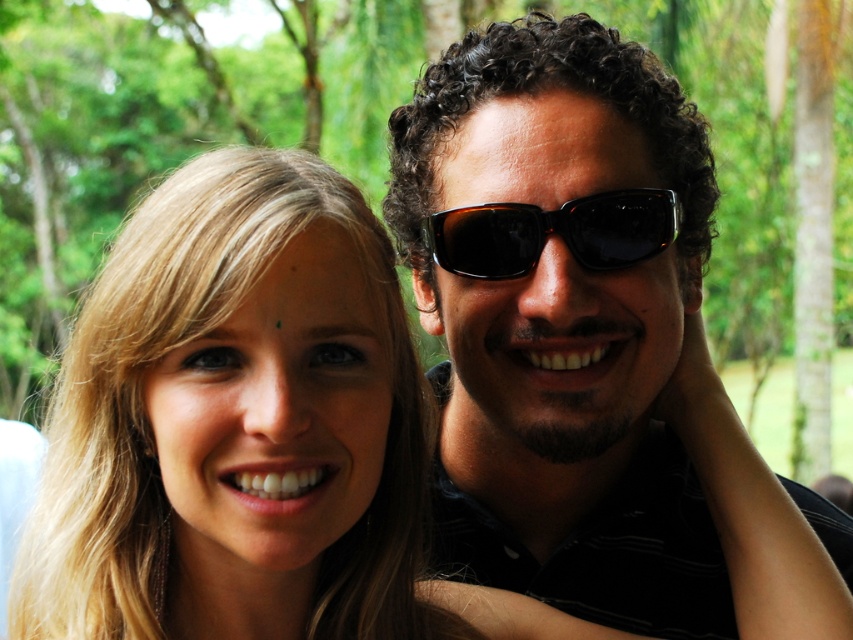
Between matte black sunglasses at center and black plastic sunglasses at center, which one has more height?

matte black sunglasses at center is taller.

Can you confirm if matte black sunglasses at center is shorter than black plastic sunglasses at center?

No, matte black sunglasses at center is not shorter than black plastic sunglasses at center.

Who is more forward, (413, 259) or (639, 211)?

Point (639, 211) is more forward.

Locate an element on the screen. The width and height of the screenshot is (853, 640). matte black sunglasses at center is located at coordinates 589,344.

Does matte black sunglasses at center have a lesser width compared to blonde hair at center?

No, matte black sunglasses at center is not thinner than blonde hair at center.

The width and height of the screenshot is (853, 640). Identify the location of matte black sunglasses at center. click(589, 344).

Does blonde hair at center have a greater height compared to black plastic sunglasses at center?

Yes.

Is blonde hair at center shorter than black plastic sunglasses at center?

In fact, blonde hair at center may be taller than black plastic sunglasses at center.

Where is `blonde hair at center`? The height and width of the screenshot is (640, 853). blonde hair at center is located at coordinates (235, 424).